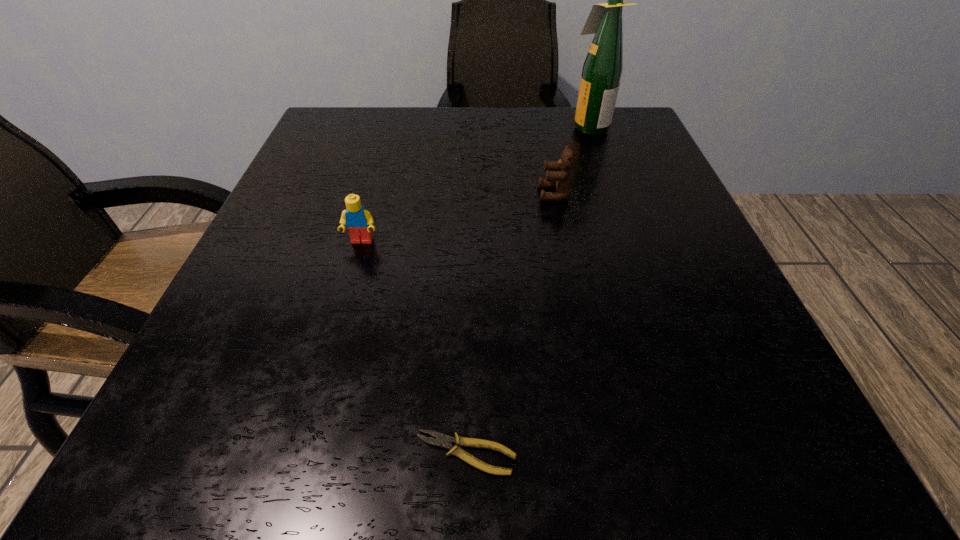
This screenshot has height=540, width=960. In order to click on vacant space that is in between the third object from left to right and the nearest object in this screenshot , I will do pyautogui.click(x=511, y=323).

This screenshot has width=960, height=540. What are the coordinates of `vacant area that lies between the leftmost object and the pliers` in the screenshot? It's located at (414, 347).

What are the coordinates of `empty location between the liquor and the leftmost object` in the screenshot? It's located at (475, 184).

Where is `free space between the teddy bear and the third object from right to left`? This screenshot has height=540, width=960. free space between the teddy bear and the third object from right to left is located at coordinates pyautogui.click(x=511, y=323).

I want to click on free space between the nearest object and the tallest object, so click(x=527, y=290).

The image size is (960, 540). I want to click on vacant point located between the leftmost object and the second farthest object, so click(458, 218).

Locate an element on the screen. The image size is (960, 540). free point between the second farthest object and the Lego is located at coordinates (x=458, y=218).

In order to click on object that is the third closest to the tallest object in this screenshot , I will do `click(443, 441)`.

Find the location of `object that is the second closest to the liquor`. object that is the second closest to the liquor is located at coordinates (358, 220).

In order to click on vacant region that satisfies the following two spatial constraints: 1. on the face of the teddy bear; 2. on the front-facing side of the Lego in this screenshot , I will do `click(564, 241)`.